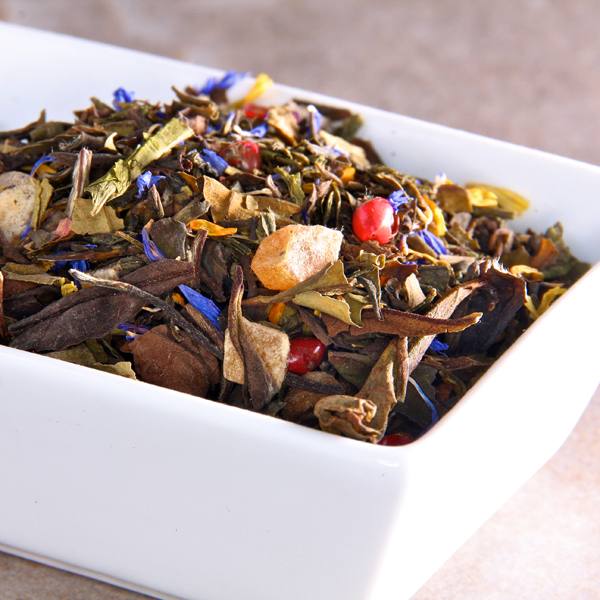
Identify the location of pot puri. (403, 281).